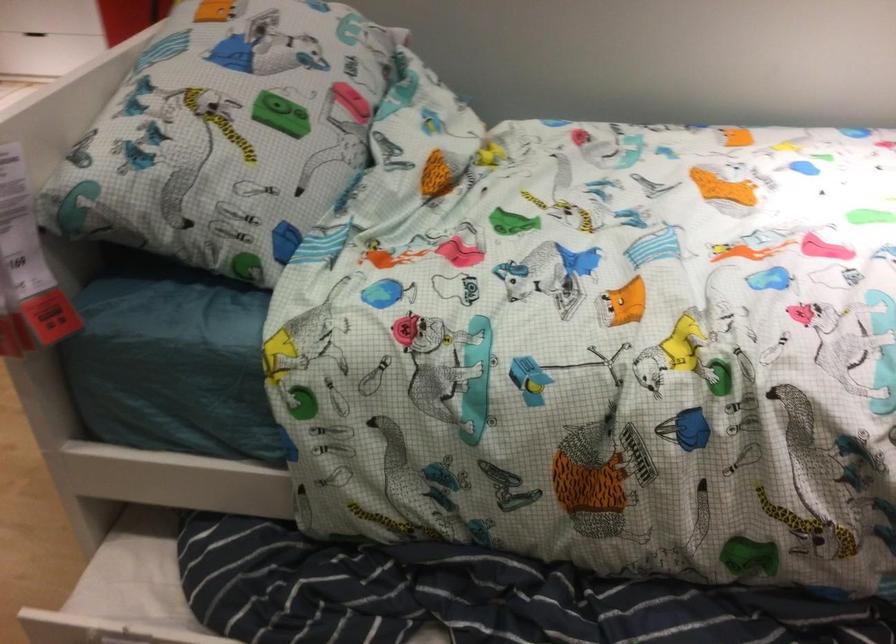
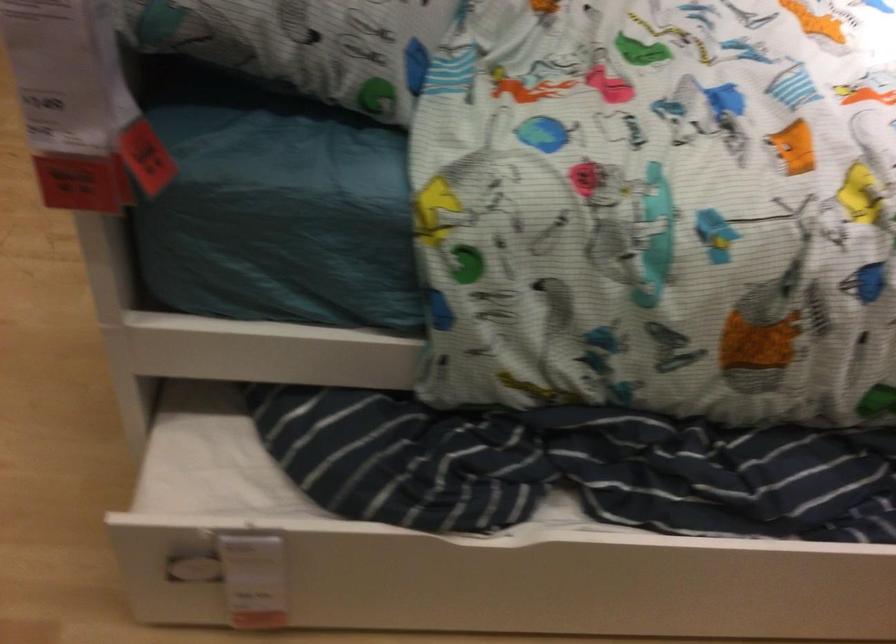
In a continuous first-person perspective shot, in which direction is the camera moving?

The cameraman walked toward left, forward.